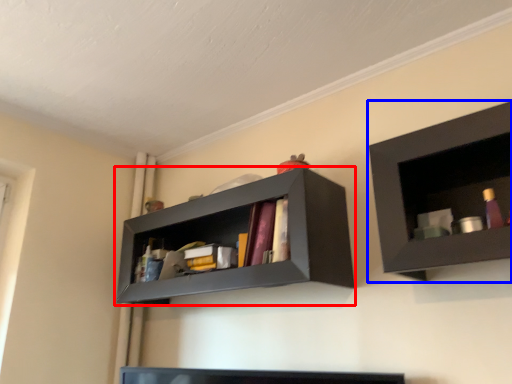
Question: Which object appears closest to the camera in this image, shelf (highlighted by a red box) or shelf (highlighted by a blue box)?

Choices:
 (A) shelf
 (B) shelf

Answer: (B)